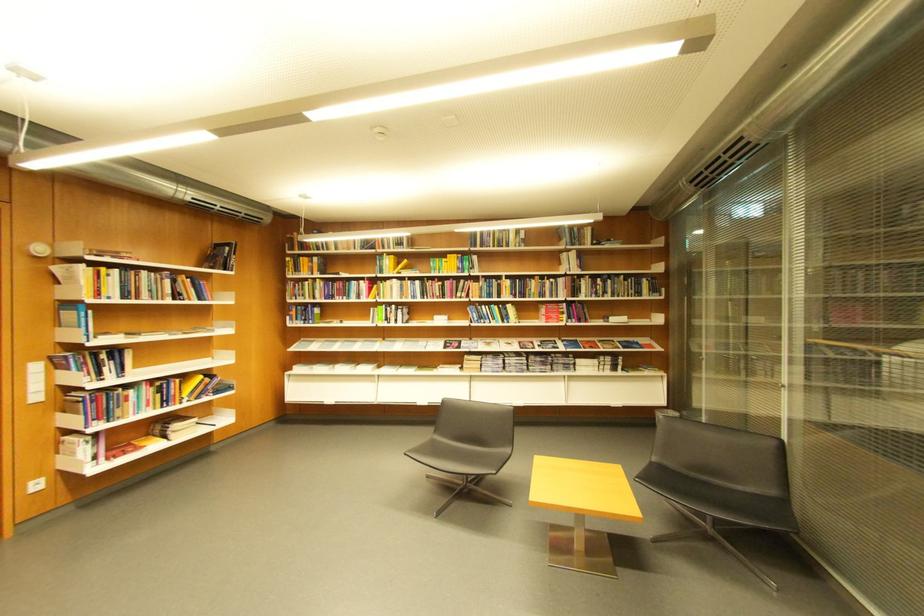
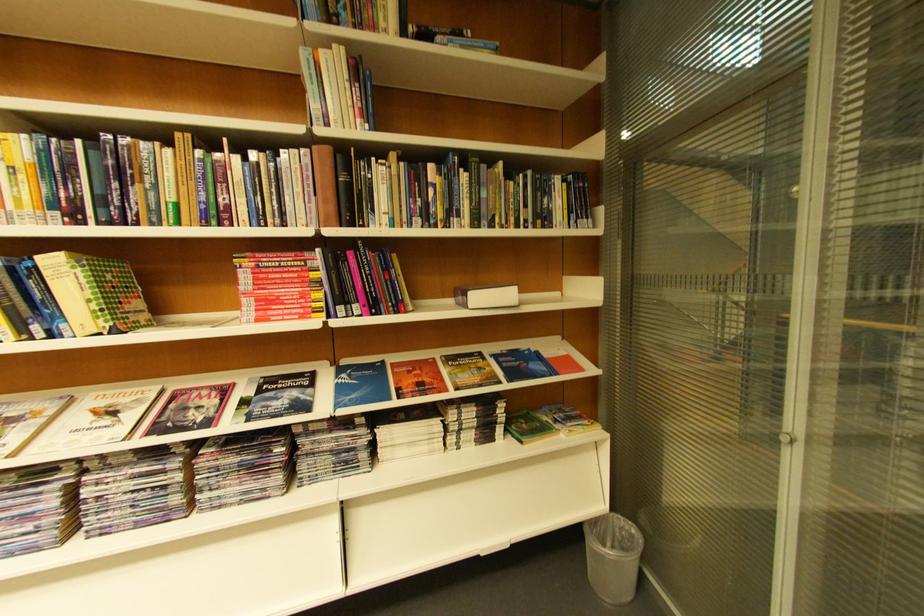
Find the pixel in the second image that matches (x=539, y=342) in the first image.

(224, 389)